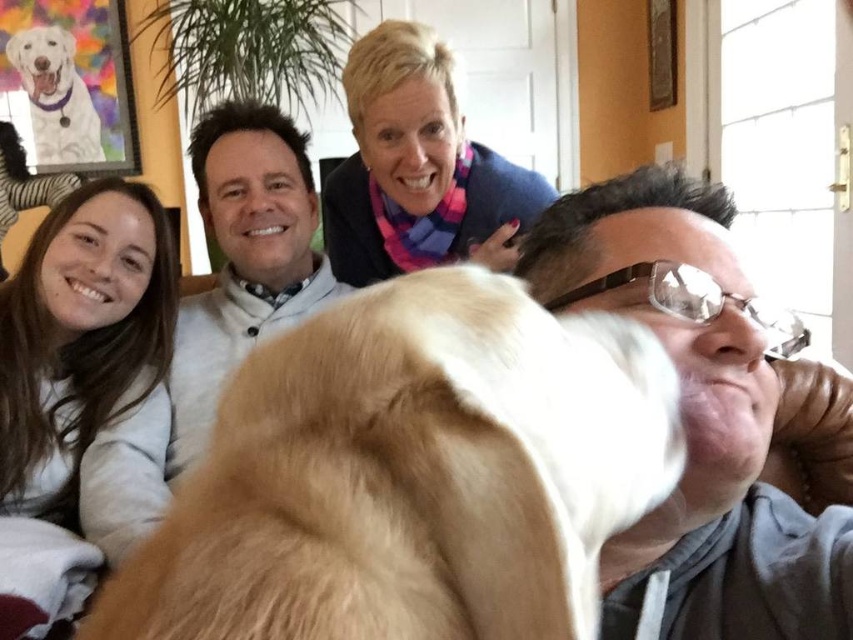
Question: Among these objects, which one is farthest from the camera?

Choices:
 (A) pink fabric scarf at upper center
 (B) white fur dog at upper left
 (C) white soft shirt at center
 (D) matte brown leather jacket at right

Answer: (B)

Question: Is pink fabric scarf at upper center to the right of white soft shirt at center from the viewer's perspective?

Choices:
 (A) no
 (B) yes

Answer: (B)

Question: Among these points, which one is nearest to the camera?

Choices:
 (A) (314, 291)
 (B) (653, 240)
 (C) (45, 118)
 (D) (134, 612)

Answer: (D)

Question: Which object is the closest to the pink fabric scarf at upper center?

Choices:
 (A) white soft shirt at center
 (B) golden fur dog at center

Answer: (A)

Question: Is matte brown leather jacket at right above light brown hair at lower left?

Choices:
 (A) no
 (B) yes

Answer: (B)

Question: Does matte brown leather jacket at right have a lesser width compared to white soft shirt at center?

Choices:
 (A) yes
 (B) no

Answer: (A)